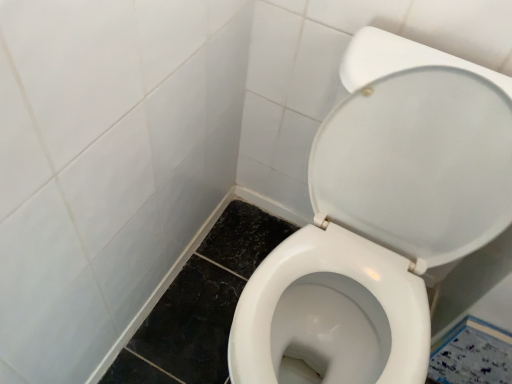
Question: From the image's perspective, is white glossy tile at lower right under white glossy toilet at center?

Choices:
 (A) no
 (B) yes

Answer: (B)

Question: From the image's perspective, is white glossy tile at lower right on top of white glossy toilet at center?

Choices:
 (A) no
 (B) yes

Answer: (A)

Question: Is white glossy tile at lower right thinner than white glossy toilet at center?

Choices:
 (A) yes
 (B) no

Answer: (A)

Question: Is white glossy tile at lower right outside white glossy toilet at center?

Choices:
 (A) no
 (B) yes

Answer: (B)

Question: Can you confirm if white glossy tile at lower right is taller than white glossy toilet at center?

Choices:
 (A) yes
 (B) no

Answer: (B)

Question: Is white glossy tile at lower right facing away from white glossy toilet at center?

Choices:
 (A) no
 (B) yes

Answer: (A)

Question: Considering the relative sizes of white glossy toilet at center and white glossy tile at lower right in the image provided, is white glossy toilet at center shorter than white glossy tile at lower right?

Choices:
 (A) yes
 (B) no

Answer: (B)

Question: Is white glossy toilet at center surrounding white glossy tile at lower right?

Choices:
 (A) yes
 (B) no

Answer: (B)

Question: Is white glossy toilet at center wider than white glossy tile at lower right?

Choices:
 (A) yes
 (B) no

Answer: (A)

Question: From a real-world perspective, is white glossy toilet at center over white glossy tile at lower right?

Choices:
 (A) no
 (B) yes

Answer: (B)

Question: Is white glossy toilet at center outside of white glossy tile at lower right?

Choices:
 (A) yes
 (B) no

Answer: (A)

Question: Can you confirm if white glossy toilet at center is taller than white glossy tile at lower right?

Choices:
 (A) yes
 (B) no

Answer: (A)

Question: In terms of width, does white glossy tile at lower right look wider or thinner when compared to white glossy toilet at center?

Choices:
 (A) wide
 (B) thin

Answer: (B)